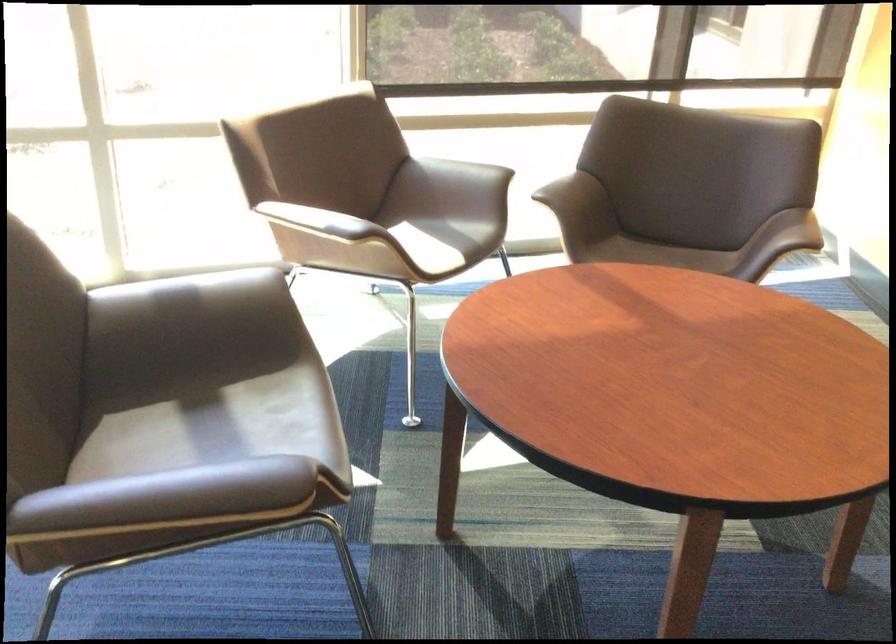
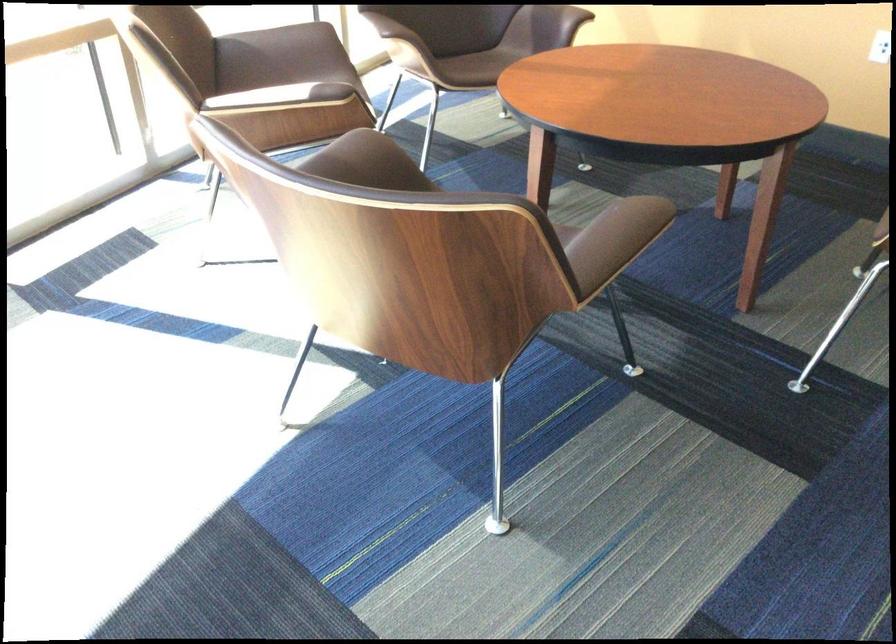
In the second image, find the point that corresponds to (x=185, y=486) in the first image.

(614, 240)